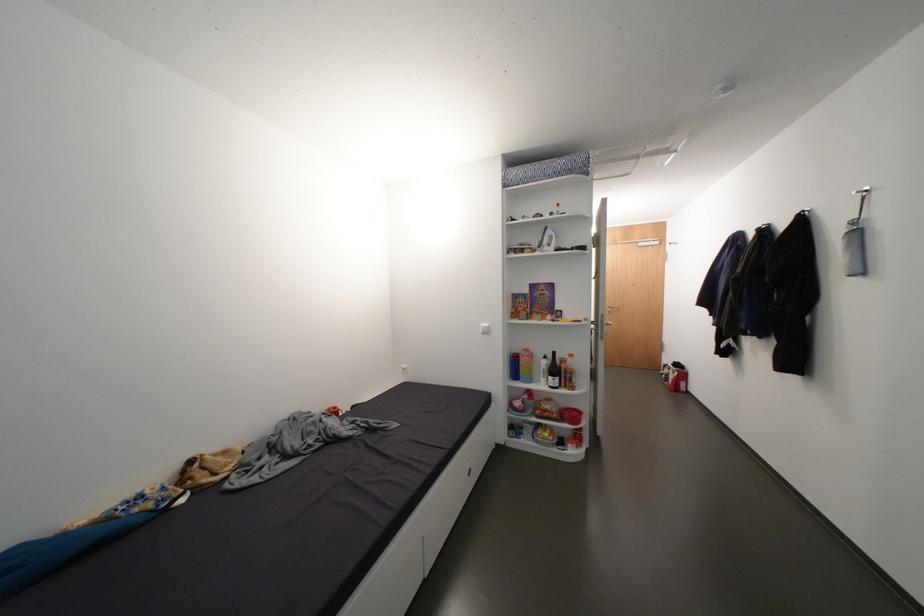
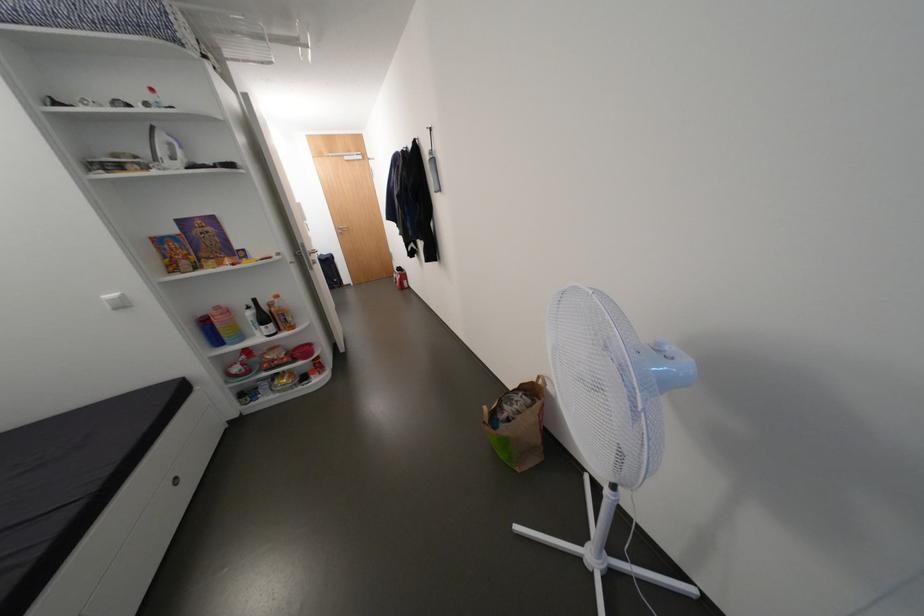
The point at [570,367] is marked in the first image. Where is the corresponding point in the second image?

(281, 310)